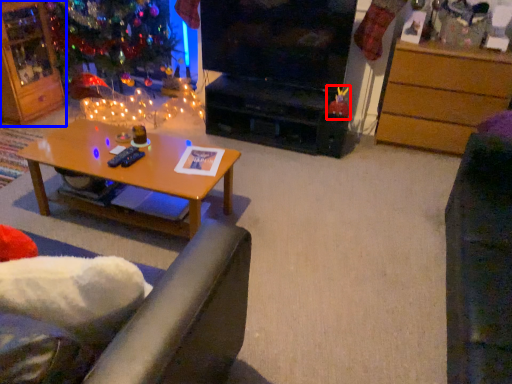
Question: Which of the following is the farthest to the observer, toy (highlighted by a red box) or cabinetry (highlighted by a blue box)?

Choices:
 (A) toy
 (B) cabinetry

Answer: (A)